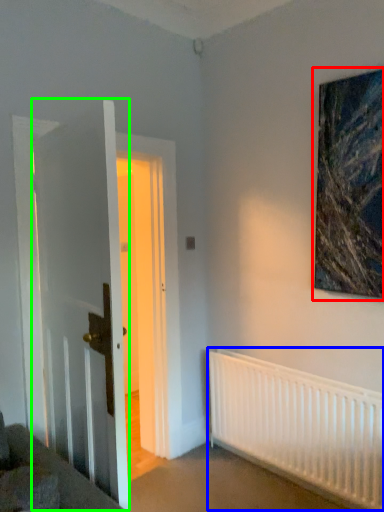
Question: Which object is the closest to the picture frame (highlighted by a red box)? Choose among these: radiator (highlighted by a blue box) or door (highlighted by a green box).

Choices:
 (A) radiator
 (B) door

Answer: (A)